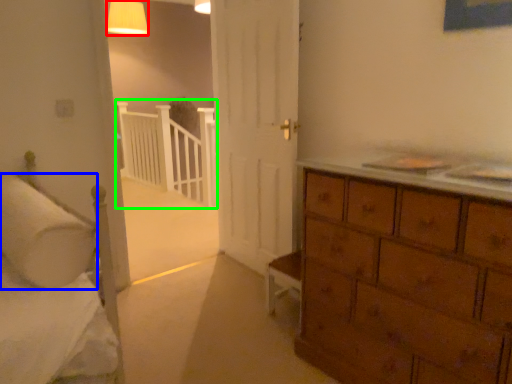
Question: Based on their relative distances, which object is farther from lighting (highlighted by a red box)? Choose from pillow (highlighted by a blue box) and balustrade (highlighted by a green box).

Choices:
 (A) pillow
 (B) balustrade

Answer: (A)